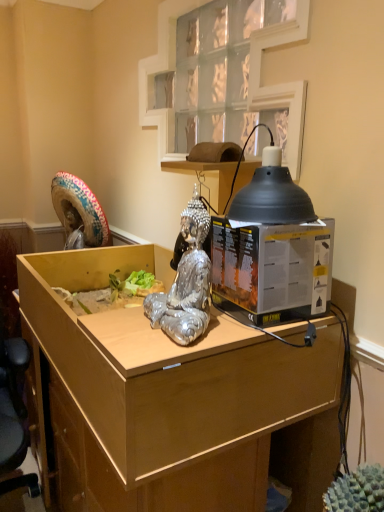
Question: Is black matte lampshade at upper right smaller than shiny silver statue at center?

Choices:
 (A) yes
 (B) no

Answer: (A)

Question: Is black matte lampshade at upper right behind shiny silver statue at center?

Choices:
 (A) no
 (B) yes

Answer: (B)

Question: From the image's perspective, is black matte lampshade at upper right over shiny silver statue at center?

Choices:
 (A) no
 (B) yes

Answer: (B)

Question: Is black matte lampshade at upper right not within shiny silver statue at center?

Choices:
 (A) no
 (B) yes

Answer: (B)

Question: Is black matte lampshade at upper right aimed at shiny silver statue at center?

Choices:
 (A) no
 (B) yes

Answer: (A)

Question: Considering the positions of black matte lampshade at upper right and shiny silver statue at center in the image, is black matte lampshade at upper right taller or shorter than shiny silver statue at center?

Choices:
 (A) tall
 (B) short

Answer: (B)

Question: Is black matte lampshade at upper right bigger or smaller than shiny silver statue at center?

Choices:
 (A) small
 (B) big

Answer: (A)

Question: From the image's perspective, relative to shiny silver statue at center, is black matte lampshade at upper right above or below?

Choices:
 (A) below
 (B) above

Answer: (B)

Question: Looking at their shapes, would you say black matte lampshade at upper right is wider or thinner than shiny silver statue at center?

Choices:
 (A) thin
 (B) wide

Answer: (B)

Question: Based on their sizes in the image, would you say black matte lampshade at upper right is bigger or smaller than wooden desk at center?

Choices:
 (A) big
 (B) small

Answer: (B)

Question: Does point (233, 200) appear closer or farther from the camera than point (288, 433)?

Choices:
 (A) closer
 (B) farther

Answer: (A)

Question: Relative to wooden desk at center, is black matte lampshade at upper right in front or behind?

Choices:
 (A) behind
 (B) front

Answer: (A)

Question: Would you say black matte lampshade at upper right is inside or outside wooden desk at center?

Choices:
 (A) inside
 (B) outside

Answer: (B)

Question: Does point (284, 309) appear closer or farther from the camera than point (182, 234)?

Choices:
 (A) farther
 (B) closer

Answer: (A)

Question: Visually, is matte black desktop computer at center positioned to the left or to the right of shiny silver statue at center?

Choices:
 (A) right
 (B) left

Answer: (A)